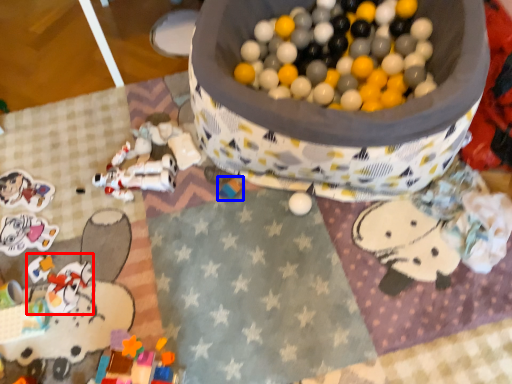
Question: Which of the following is the farthest to the observer, toy (highlighted by a red box) or toy (highlighted by a blue box)?

Choices:
 (A) toy
 (B) toy

Answer: (B)